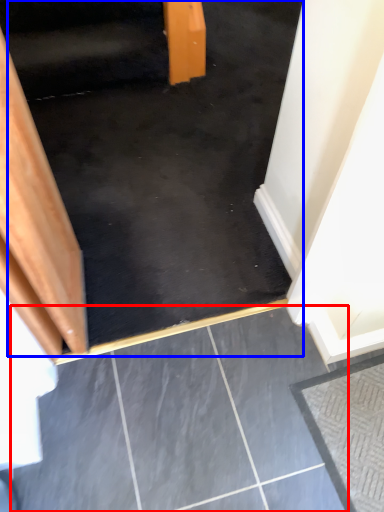
Question: Among these objects, which one is nearest to the camera, concrete (highlighted by a red box) or stairs (highlighted by a blue box)?

Choices:
 (A) concrete
 (B) stairs

Answer: (A)